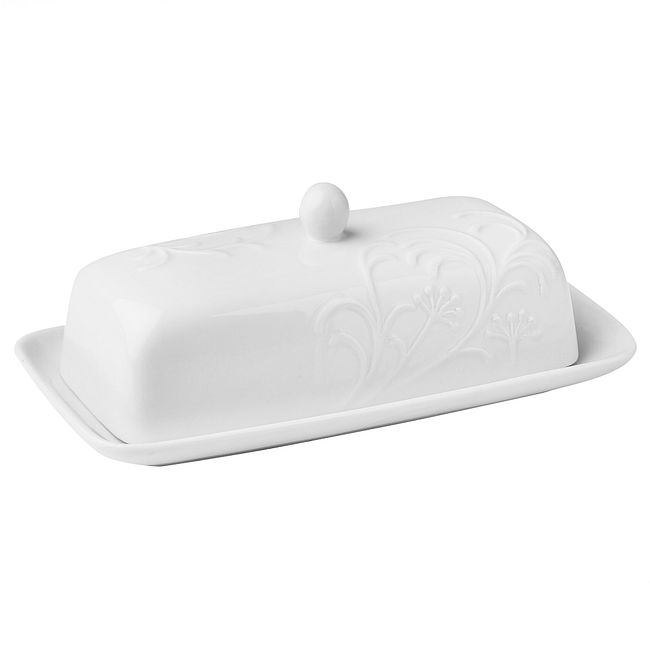
Locate an element on the screen. This screenshot has width=650, height=650. wavy embroidery is located at coordinates (382, 348), (483, 318).